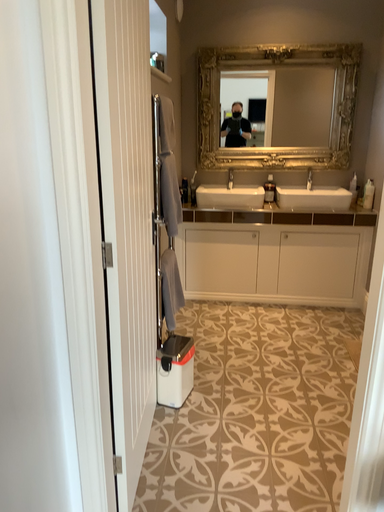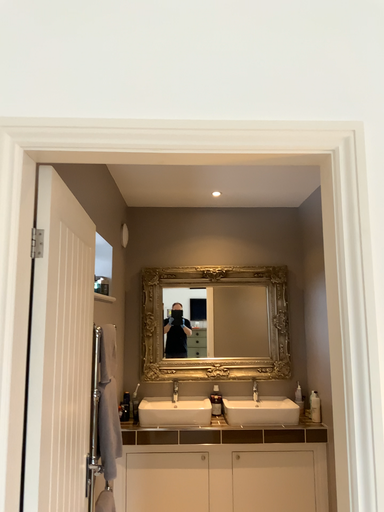
Question: How did the camera likely rotate when shooting the video?

Choices:
 (A) rotated downward
 (B) rotated upward

Answer: (B)